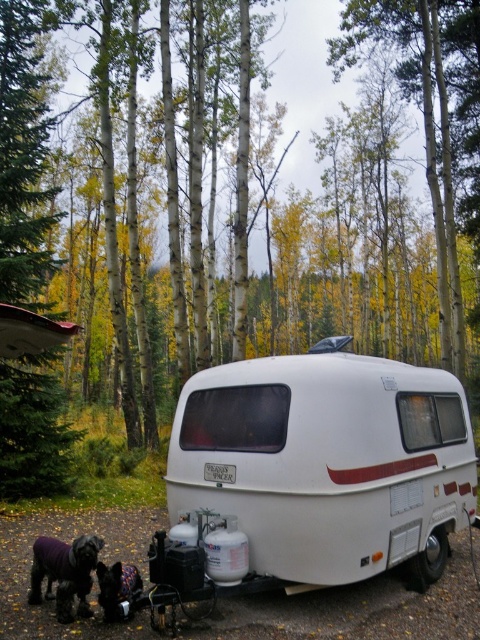
You are standing in front of the vintage travel trailer in the forest. You notice two points marked on the trailer. One is at coordinate point (32, 460) and the other at point (110, 570). Which point is closer to you?

Point (32, 460) is closer to you because it is further to the viewer than point (110, 570).

You are standing near the vintage travel trailer in the forest and see both the dark brown fur at lower left and the black fur dog at lower left. Which one is closer to you?

The dark brown fur at lower left is closer to you because it is further to the viewer than the black fur dog at lower left.

You are a hiker who just arrived at the camping site and see the dark brown fur at lower left and the black fur dog at lower left. Which one is closer to your left side?

The dark brown fur at lower left is to the left of black fur dog at lower left, so it is closer to your left side.